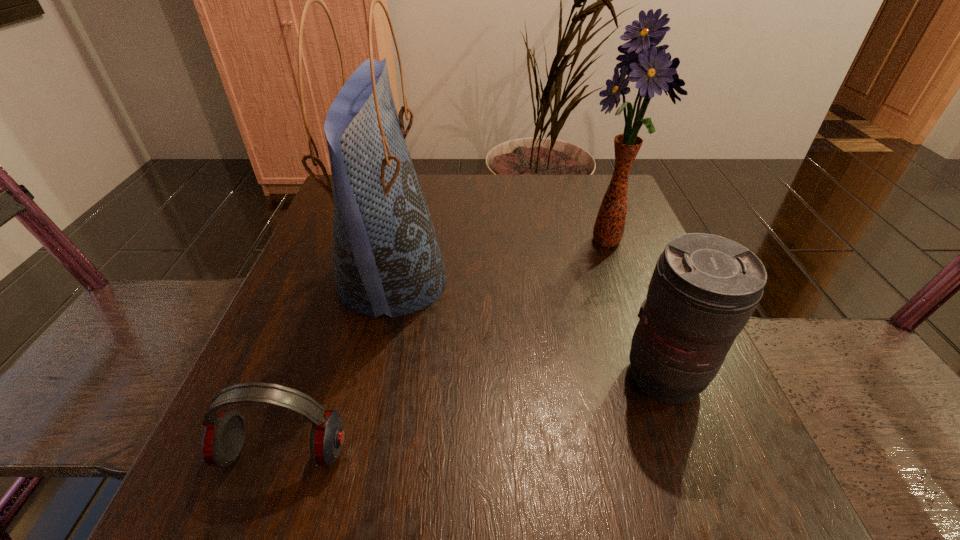
Locate an element on the screen. This screenshot has width=960, height=540. free point between the telephoto lens and the flower arrangement is located at coordinates 636,309.

I want to click on free space between the flower arrangement and the telephoto lens, so click(x=636, y=309).

Find the location of a particular element. The width and height of the screenshot is (960, 540). vacant space that is in between the flower arrangement and the shopping bag is located at coordinates pos(500,260).

Find the location of a particular element. The height and width of the screenshot is (540, 960). object that ranks as the third closest to the shortest object is located at coordinates [653, 70].

Identify which object is the third nearest to the third tallest object. Please provide its 2D coordinates. Your answer should be formatted as a tuple, i.e. [(x, y)], where the tuple contains the x and y coordinates of a point satisfying the conditions above.

[(223, 438)]